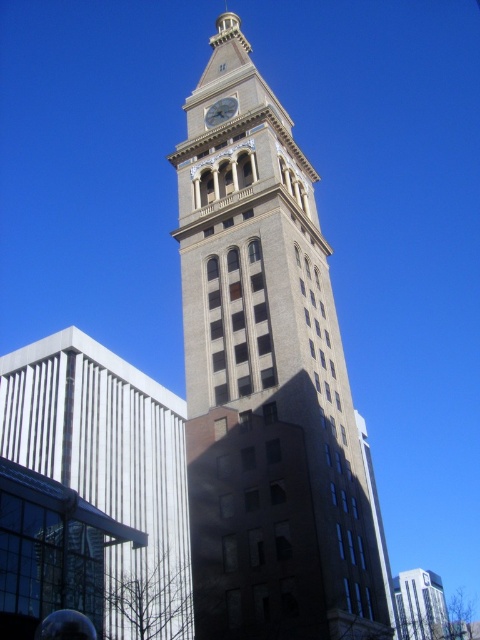
You are a city planner assessing the space between the beige stone clock tower at center and the gold metallic clock at center. Which object occupies more horizontal space in the image?

The beige stone clock tower at center is wider than the gold metallic clock at center, so it occupies more horizontal space.

Consider the image. You are standing at the base of the clock tower and see two points marked on the ground. One is labeled as point (216,548) and the other as point (216,122). Which point is closer to the clock tower?

Point (216,548) is closer to the clock tower because it is in front of point (216,122).

You are standing at the center of the image. Which direction should you move to get closer to the beige stone clock tower at center?

The beige stone clock tower at center is already at the center of the image, so you don not need to move in any direction to get closer.